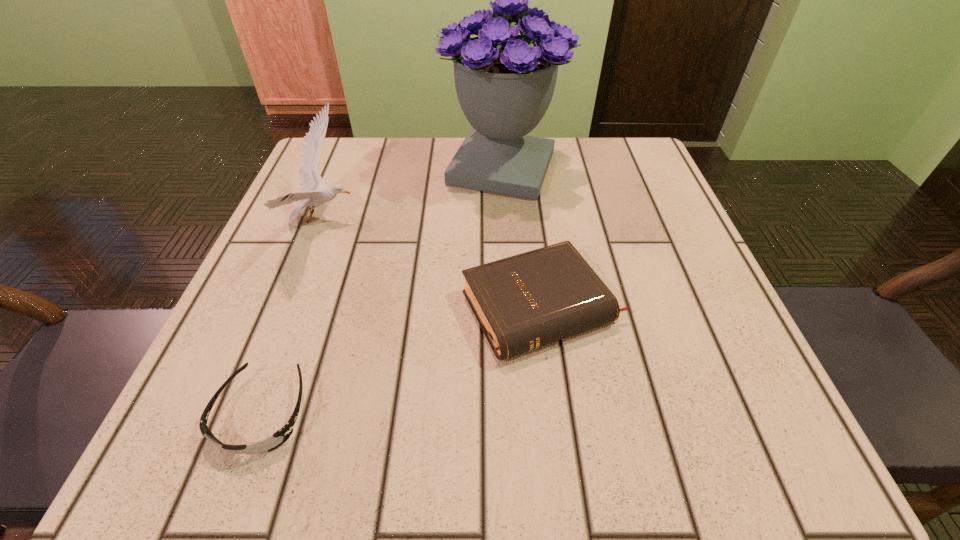
Identify the location of free point between the third shortest object and the sunglasses. (293, 317).

The width and height of the screenshot is (960, 540). I want to click on empty space between the gull and the sunglasses, so click(293, 317).

Where is `object identified as the second closest to the gull`? The image size is (960, 540). object identified as the second closest to the gull is located at coordinates (279, 437).

Locate an element on the screen. The image size is (960, 540). the third closest object to the nearest object is located at coordinates (504, 82).

The image size is (960, 540). What are the coordinates of `vacant space that satisfies the following two spatial constraints: 1. at the tip of the beak of the second shortest object; 2. on the right side of the second tallest object` in the screenshot? It's located at (289, 308).

At what (x,y) coordinates should I click in order to perform the action: click on vacant area in the image that satisfies the following two spatial constraints: 1. on the front side of the tallest object; 2. at the tip of the beak of the third shortest object. Please return your answer as a coordinate pair (x, y). Looking at the image, I should click on (506, 220).

Locate an element on the screen. free region that satisfies the following two spatial constraints: 1. on the front side of the Bible; 2. on the right side of the tallest object is located at coordinates (512, 308).

Locate an element on the screen. free location that satisfies the following two spatial constraints: 1. at the tip of the beak of the gull; 2. on the right side of the second shortest object is located at coordinates (289, 308).